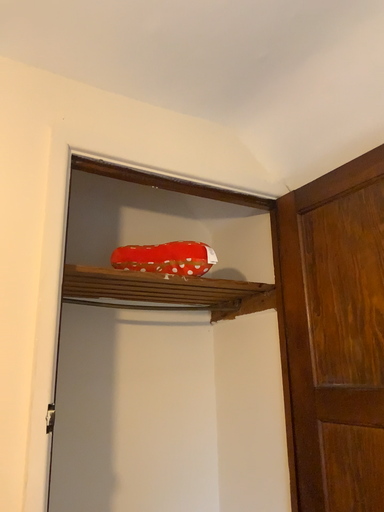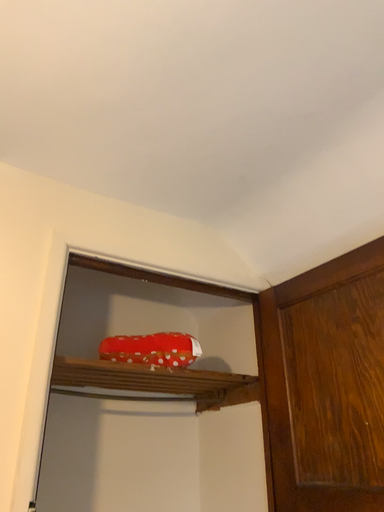
Question: Which way did the camera rotate in the video?

Choices:
 (A) rotated downward
 (B) rotated upward

Answer: (B)